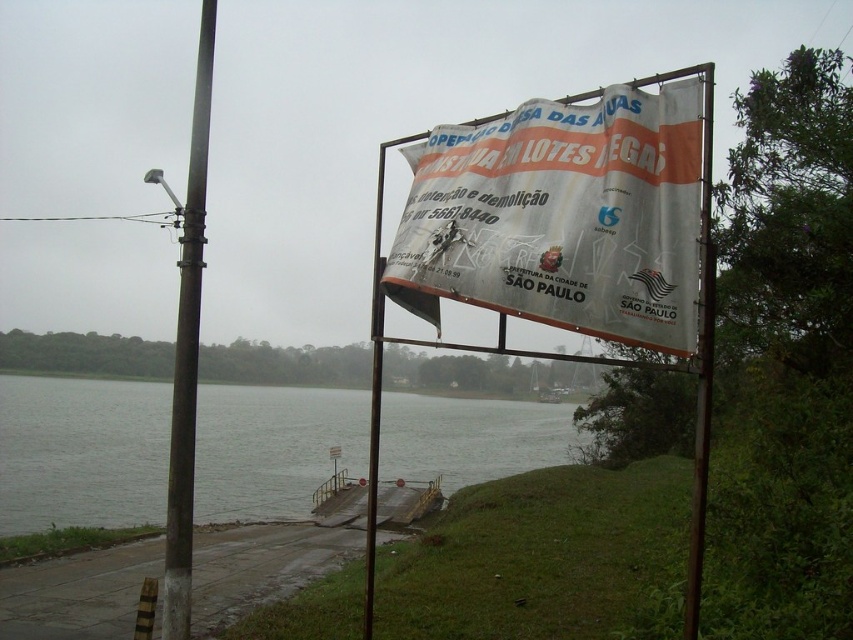
Can you confirm if white fabric banner at center is positioned to the left of white plastic pole at upper center?

Indeed, white fabric banner at center is positioned on the left side of white plastic pole at upper center.

Is white fabric banner at center smaller than white plastic pole at upper center?

Correct, white fabric banner at center occupies less space than white plastic pole at upper center.

Is point (602, 189) positioned after point (712, 337)?

Yes.

Identify the location of white fabric banner at center. The height and width of the screenshot is (640, 853). (561, 218).

Is white fabric banner at center above smooth brown pole at left?

Indeed, white fabric banner at center is positioned over smooth brown pole at left.

Does white fabric banner at center come behind smooth brown pole at left?

That is False.

Consider the image. Who is more distant from viewer, (602, 269) or (172, 512)?

The point (172, 512) is behind.

At what (x,y) coordinates should I click in order to perform the action: click on white fabric banner at center. Please return your answer as a coordinate pair (x, y). The height and width of the screenshot is (640, 853). Looking at the image, I should click on (561, 218).

Can you confirm if smooth brown pole at left is positioned to the right of white paper banner at center?

In fact, smooth brown pole at left is to the left of white paper banner at center.

You are a GUI agent. You are given a task and a screenshot of the screen. Output one action in this format:
    pyautogui.click(x=<x>, y=<y>)
    Task: Click on the smooth brown pole at left
    Image resolution: width=853 pixels, height=640 pixels.
    Given the screenshot: What is the action you would take?
    pyautogui.click(x=187, y=352)

At what (x,y) coordinates should I click in order to perform the action: click on smooth brown pole at left. Please return your answer as a coordinate pair (x, y). This screenshot has width=853, height=640. Looking at the image, I should click on coord(187,352).